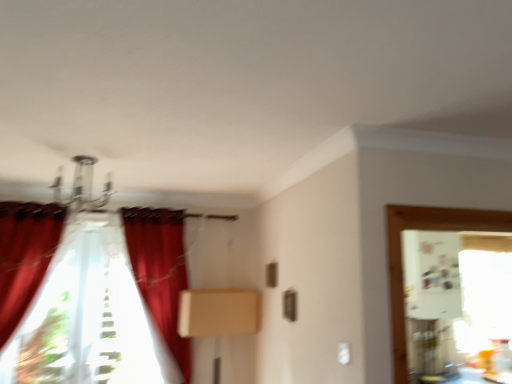
Question: Can you confirm if metallic chandelier at upper center is shorter than velvet red curtain at left, arranged as the 3th curtain when viewed from the right?

Choices:
 (A) yes
 (B) no

Answer: (A)

Question: Considering the relative positions of metallic chandelier at upper center and velvet red curtain at left, arranged as the 3th curtain when viewed from the right, in the image provided, is metallic chandelier at upper center to the right of velvet red curtain at left, arranged as the 3th curtain when viewed from the right, from the viewer's perspective?

Choices:
 (A) no
 (B) yes

Answer: (B)

Question: Can you confirm if metallic chandelier at upper center is taller than velvet red curtain at left, acting as the first curtain starting from the left?

Choices:
 (A) no
 (B) yes

Answer: (A)

Question: Can you confirm if metallic chandelier at upper center is thinner than velvet red curtain at left, arranged as the 3th curtain when viewed from the right?

Choices:
 (A) no
 (B) yes

Answer: (A)

Question: Can you confirm if metallic chandelier at upper center is wider than velvet red curtain at left, arranged as the 3th curtain when viewed from the right?

Choices:
 (A) no
 (B) yes

Answer: (B)

Question: Does metallic chandelier at upper center come behind velvet red curtain at left, acting as the first curtain starting from the left?

Choices:
 (A) no
 (B) yes

Answer: (A)

Question: Considering the relative sizes of beige cardboard box at center and velvet red curtain at left, arranged as the 3th curtain when viewed from the right, in the image provided, is beige cardboard box at center wider than velvet red curtain at left, arranged as the 3th curtain when viewed from the right,?

Choices:
 (A) yes
 (B) no

Answer: (A)

Question: From a real-world perspective, is beige cardboard box at center physically above velvet red curtain at left, acting as the first curtain starting from the left?

Choices:
 (A) yes
 (B) no

Answer: (B)

Question: Is beige cardboard box at center aimed at velvet red curtain at left, acting as the first curtain starting from the left?

Choices:
 (A) yes
 (B) no

Answer: (B)

Question: Is beige cardboard box at center shorter than velvet red curtain at left, acting as the first curtain starting from the left?

Choices:
 (A) yes
 (B) no

Answer: (A)

Question: Is beige cardboard box at center bigger than velvet red curtain at left, arranged as the 3th curtain when viewed from the right?

Choices:
 (A) no
 (B) yes

Answer: (A)

Question: Are beige cardboard box at center and velvet red curtain at left, arranged as the 3th curtain when viewed from the right, located far from each other?

Choices:
 (A) yes
 (B) no

Answer: (A)

Question: Is there a large distance between velvet red curtain at center, which appears as the 3th curtain when viewed from the left, and velvet red curtain at left, arranged as the 3th curtain when viewed from the right?

Choices:
 (A) yes
 (B) no

Answer: (B)